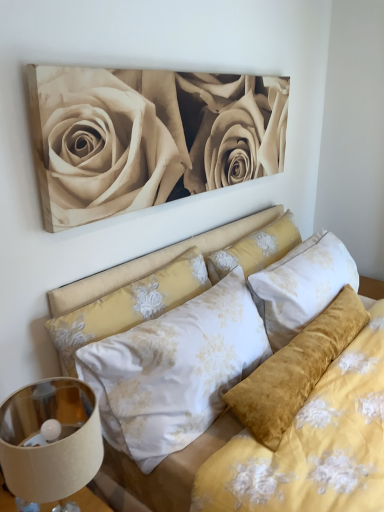
The height and width of the screenshot is (512, 384). In order to click on blank space above beige matte/soft canvas at upper center (from a real-world perspective) in this screenshot , I will do `click(179, 66)`.